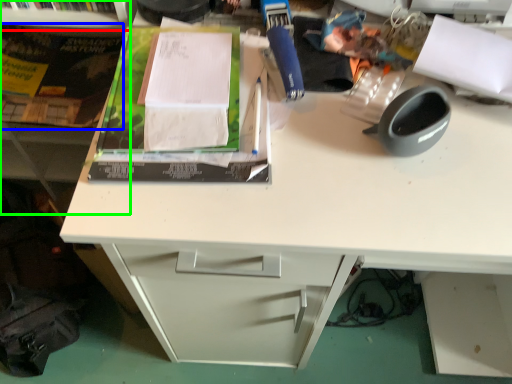
Question: Which is farther away from shelf (highlighted by a red box)? paperback book (highlighted by a blue box) or bookshelf (highlighted by a green box)?

Choices:
 (A) paperback book
 (B) bookshelf

Answer: (A)